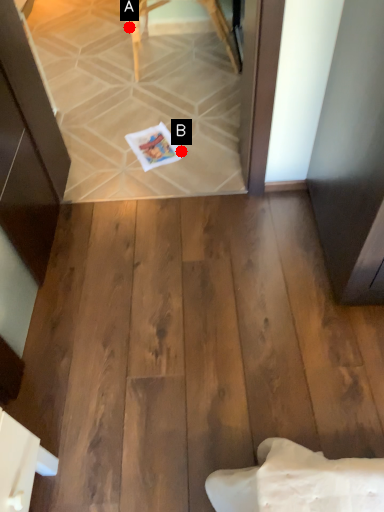
Question: Two points are circled on the image, labeled by A and B beside each circle. Which point appears farthest from the camera in this image?

Choices:
 (A) A is further
 (B) B is further

Answer: (A)